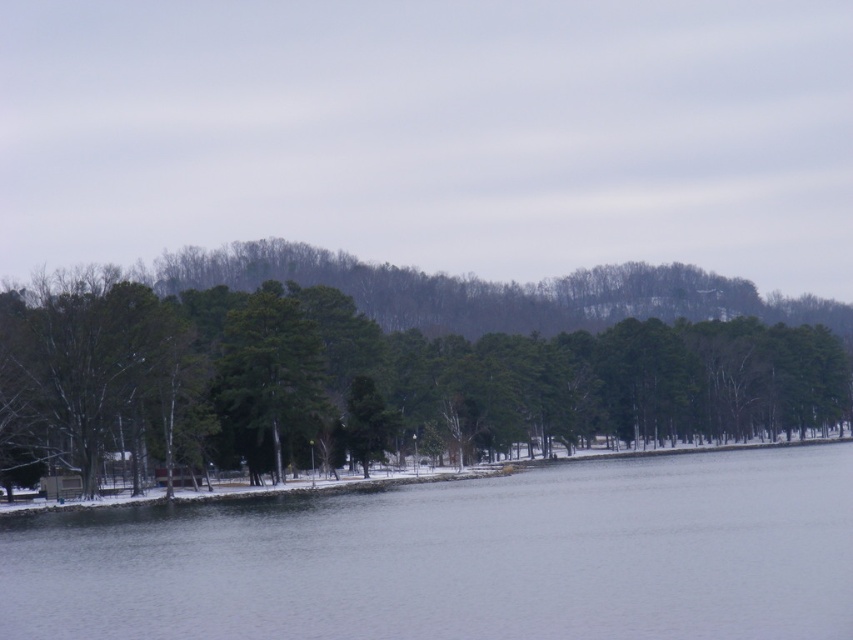
Is point (374, 512) farther from viewer compared to point (231, 412)?

No, it is not.

This screenshot has height=640, width=853. In order to click on gray/smooth water at center in this screenshot , I will do `click(463, 557)`.

From the picture: Who is taller, green matte tree at left or gray/smooth water at center?

green matte tree at left

Does green matte tree at left appear over gray/smooth water at center?

Indeed, green matte tree at left is positioned over gray/smooth water at center.

Is point (155, 289) positioned behind point (312, 572)?

Yes, point (155, 289) is farther from viewer.

The width and height of the screenshot is (853, 640). In order to click on green matte tree at left in this screenshot , I will do `click(393, 364)`.

Can you confirm if green matte tree at left is positioned below green matte tree at center?

Incorrect, green matte tree at left is not positioned below green matte tree at center.

Which is behind, point (286, 268) or point (227, 374)?

The point (286, 268) is more distant.

I want to click on green matte tree at left, so click(393, 364).